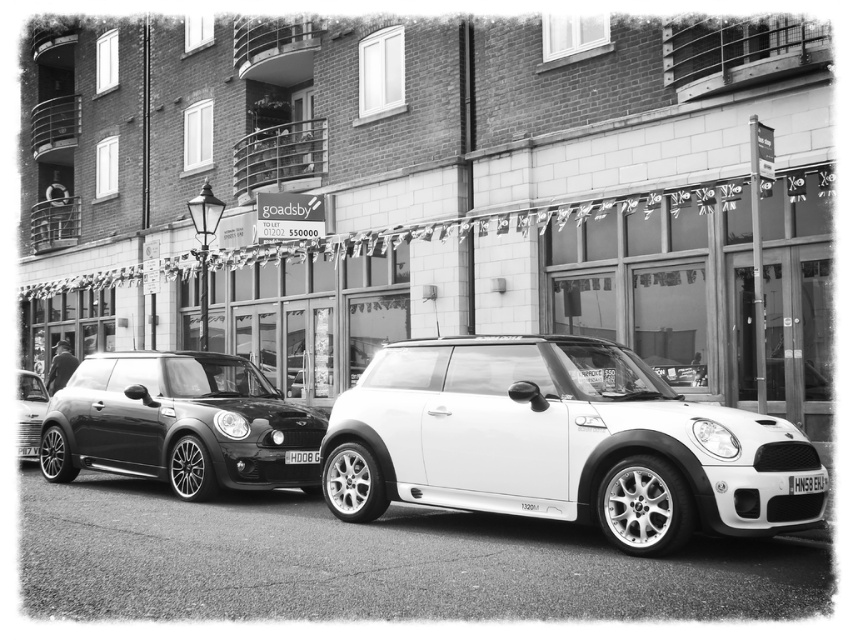
You are standing at the point marked as point (560, 444) in the image. What object is located exactly at that point?

The white metallic car at center is located exactly at point (560, 444).

You are a delivery person trying to park your car in a narrow alley next to the shiny silver car at left and the white plastic license plate at center. Based on their positions, which vehicle should you park behind to avoid blocking the license plate?

You should park behind the shiny silver car at left because it is located below the white plastic license plate at center, so parking behind it would keep the license plate visible and unobstructed.